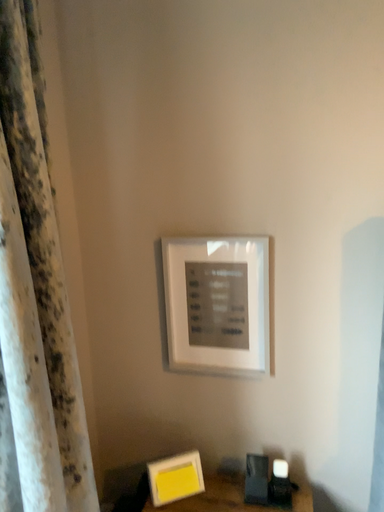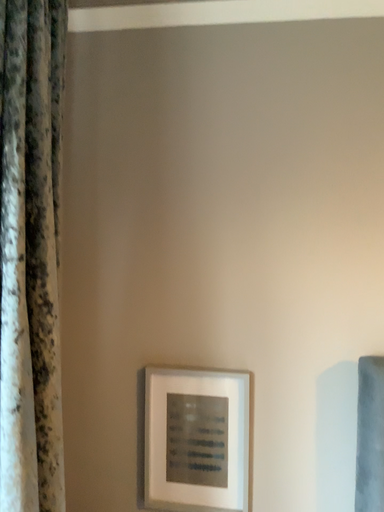
Question: How did the camera likely rotate when shooting the video?

Choices:
 (A) rotated upward
 (B) rotated downward

Answer: (A)